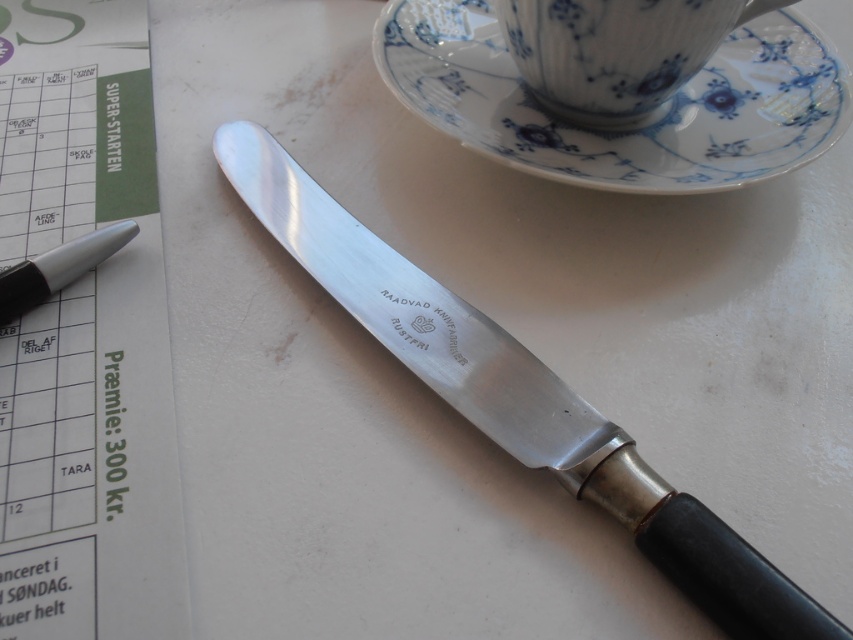
Is polished metal knife at center bigger than metallic silver pen at left?

Yes.

Does polished metal knife at center appear on the right side of metallic silver pen at left?

Yes, polished metal knife at center is to the right of metallic silver pen at left.

You are a GUI agent. You are given a task and a screenshot of the screen. Output one action in this format:
    pyautogui.click(x=<x>, y=<y>)
    Task: Click on the polished metal knife at center
    The height and width of the screenshot is (640, 853).
    Given the screenshot: What is the action you would take?
    pyautogui.click(x=514, y=394)

Looking at this image, is the position of porcelain cup at upper right more distant than that of metallic silver pen at left?

Yes, porcelain cup at upper right is behind metallic silver pen at left.

Can you confirm if porcelain cup at upper right is shorter than metallic silver pen at left?

Incorrect, porcelain cup at upper right's height does not fall short of metallic silver pen at left's.

Does point (531, 60) come closer to viewer compared to point (30, 275)?

No, (531, 60) is further to viewer.

This screenshot has width=853, height=640. Identify the location of porcelain cup at upper right. (616, 51).

Is white porcelain saucer at upper right thinner than metallic silver pen at left?

No, white porcelain saucer at upper right is not thinner than metallic silver pen at left.

Which of these two, white porcelain saucer at upper right or metallic silver pen at left, stands shorter?

metallic silver pen at left is shorter.

Find the location of `white porcelain saucer at upper right`. white porcelain saucer at upper right is located at coordinates (633, 129).